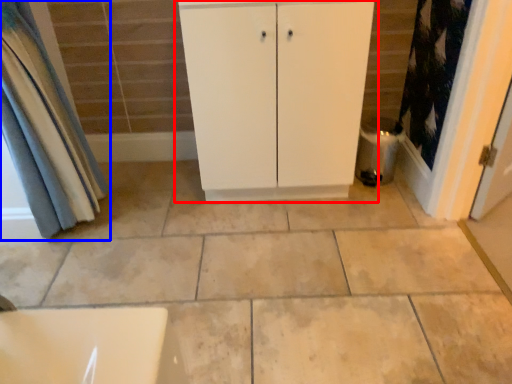
Question: Which object appears farthest to the camera in this image, bathroom cabinet (highlighted by a red box) or curtain (highlighted by a blue box)?

Choices:
 (A) bathroom cabinet
 (B) curtain

Answer: (A)